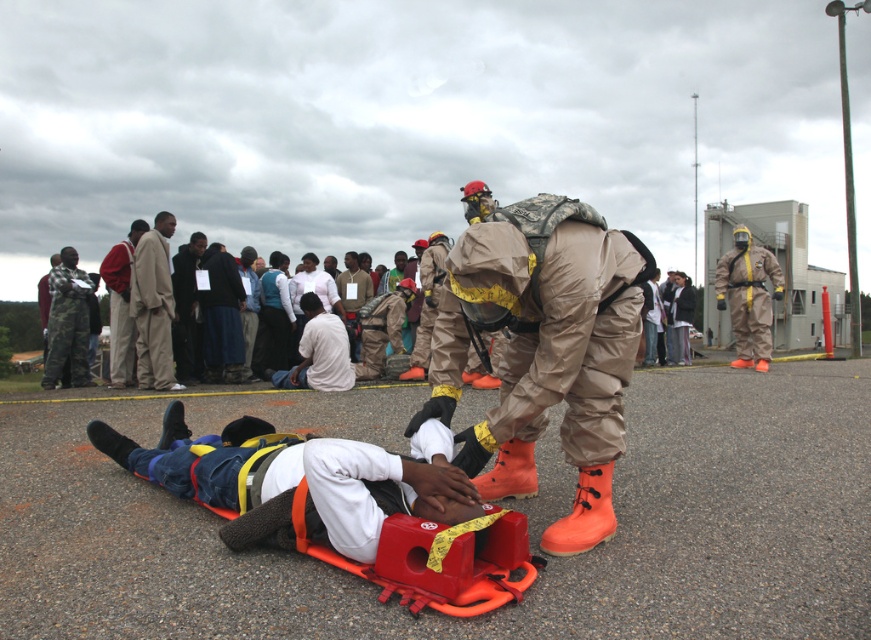
Question: Considering the relative positions of camouflage fabric hazmat suit at center and matte khaki hazmat suit at right in the image provided, where is camouflage fabric hazmat suit at center located with respect to matte khaki hazmat suit at right?

Choices:
 (A) below
 (B) above

Answer: (A)

Question: Which of the following is the closest to the observer?

Choices:
 (A) denim pants at center
 (B) beige cotton suit at center

Answer: (A)

Question: Which object is the farthest from the denim pants at center?

Choices:
 (A) camouflage fabric hazmat suit at center
 (B) beige cotton suit at center

Answer: (B)

Question: Is camouflage fabric hazmat suit at center above beige cotton suit at center?

Choices:
 (A) yes
 (B) no

Answer: (B)

Question: Is beige cotton suit at center to the left of matte khaki hazmat suit at right from the viewer's perspective?

Choices:
 (A) no
 (B) yes

Answer: (B)

Question: Which object appears farthest from the camera in this image?

Choices:
 (A) denim pants at center
 (B) camouflage fabric hazmat suit at center

Answer: (B)